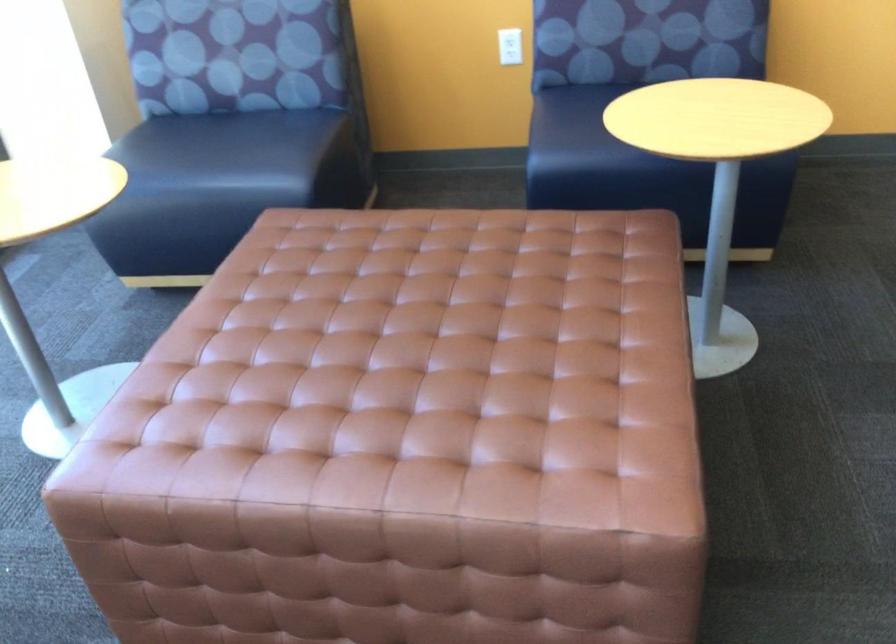
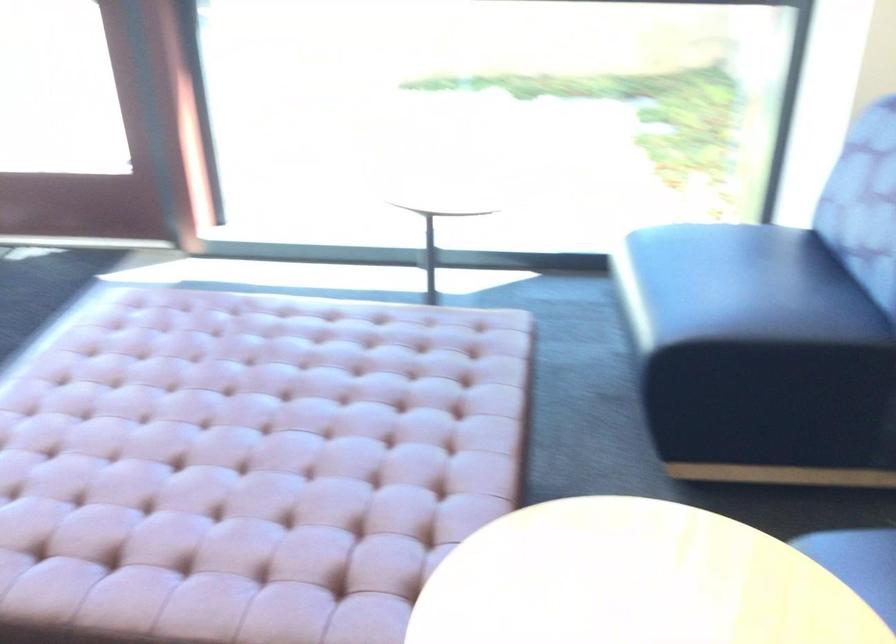
Locate, in the second image, the point that corresponds to point (277, 145) in the first image.

(724, 301)